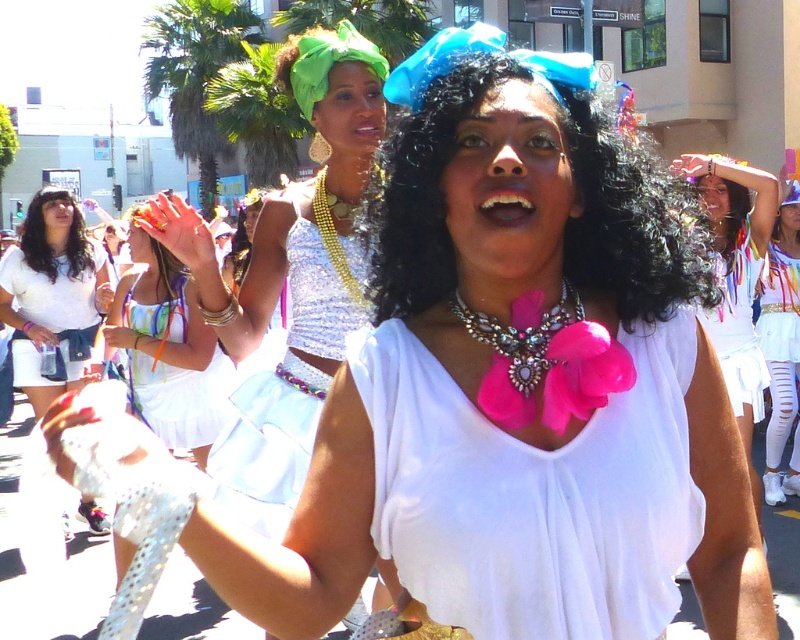
Question: Which object is closer to the camera taking this photo?

Choices:
 (A) white satin skirt at lower right
 (B) shiny silver top at center
 (C) white satin skirt at center

Answer: (B)

Question: Can you confirm if black shiny hair at left is positioned below blonde shiny hair at upper left?

Choices:
 (A) yes
 (B) no

Answer: (B)

Question: Does pink fabric bow at center have a larger size compared to pink satin bow at center?

Choices:
 (A) yes
 (B) no

Answer: (B)

Question: Considering the real-world distances, which object is closest to the white cotton shirt at center?

Choices:
 (A) blonde shiny hair at upper left
 (B) pink satin bow at center
 (C) silver/glassy necklace at center

Answer: (A)

Question: Which object is positioned closest to the black curly hair at center?

Choices:
 (A) white satin skirt at lower right
 (B) white cotton shirt at center

Answer: (A)

Question: In this image, where is black curly hair at center located relative to silver/glassy necklace at center?

Choices:
 (A) above
 (B) below

Answer: (A)